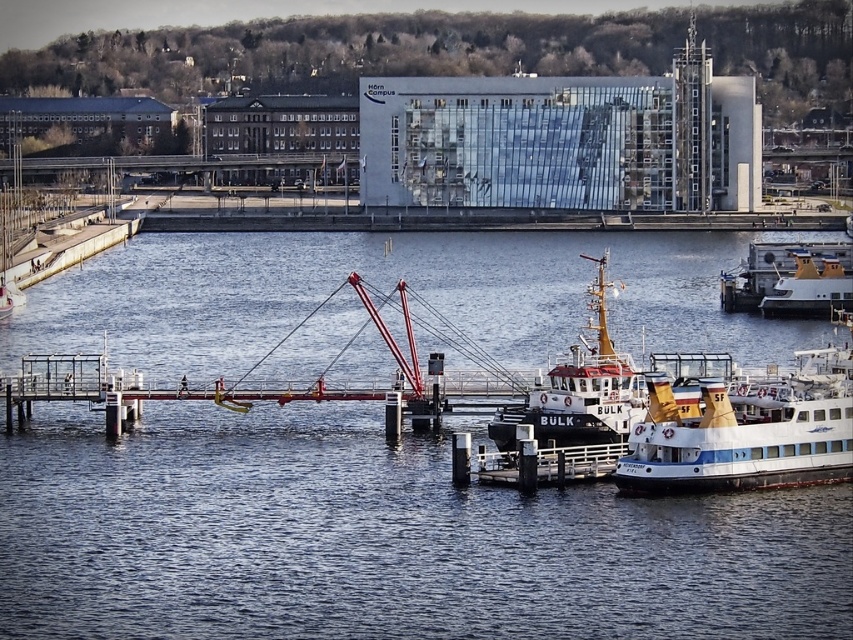
Which is more to the right, blue water at center or white glossy boat at center?

white glossy boat at center is more to the right.

Is point (312, 488) more distant than point (755, 296)?

That is False.

This screenshot has width=853, height=640. I want to click on blue water at center, so click(x=379, y=540).

Between yellow matte boat at center and white glossy boat at center, which one has more height?

yellow matte boat at center

Is point (589, 429) farther from camera compared to point (753, 241)?

No, it is not.

Image resolution: width=853 pixels, height=640 pixels. I want to click on yellow matte boat at center, so click(579, 388).

Who is shorter, blue water at center or yellow matte boat at center?

Standing shorter between the two is yellow matte boat at center.

Does blue water at center appear under yellow matte boat at center?

Yes.

Is point (579, 321) in front of point (595, 442)?

No, it is not.

At what (x,y) coordinates should I click in order to perform the action: click on blue water at center. Please return your answer as a coordinate pair (x, y). Looking at the image, I should click on (379, 540).